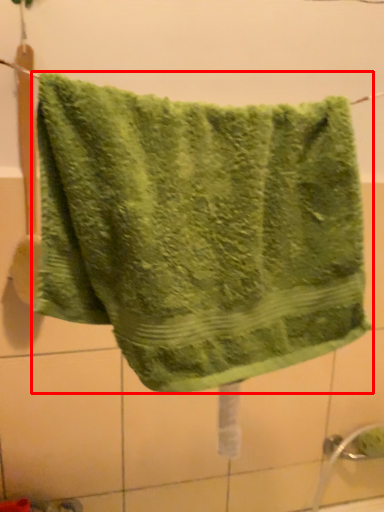
Question: From the image's perspective, what is the correct spatial positioning of towel (annotated by the red box) in reference to tile?

Choices:
 (A) below
 (B) above

Answer: (B)